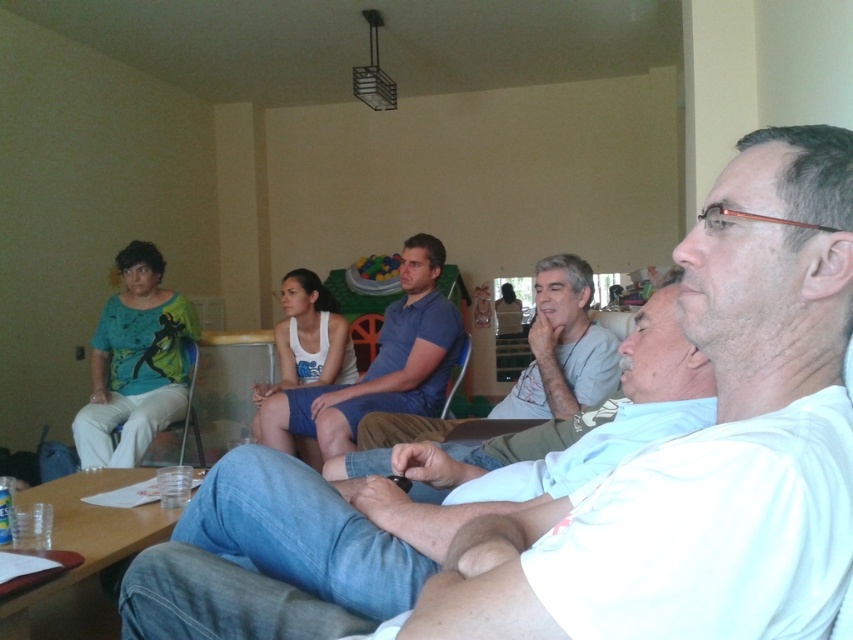
Question: Which point appears closest to the camera in this image?

Choices:
 (A) (750, 532)
 (B) (550, 285)
 (C) (286, 419)

Answer: (A)

Question: Which of the following is the farthest from the observer?

Choices:
 (A) (585, 296)
 (B) (773, 536)
 (C) (320, 424)

Answer: (C)

Question: Is white cotton shirt at center wider than blue cotton shorts at center?

Choices:
 (A) yes
 (B) no

Answer: (B)

Question: Can you confirm if blue cotton shorts at center is positioned to the left of gray cotton shirt at center?

Choices:
 (A) no
 (B) yes

Answer: (B)

Question: Among these objects, which one is nearest to the camera?

Choices:
 (A) white cotton shirt at center
 (B) gray cotton shirt at center
 (C) blue cotton shorts at center

Answer: (A)

Question: Where is blue cotton shorts at center located in relation to gray cotton shirt at center in the image?

Choices:
 (A) left
 (B) right

Answer: (A)